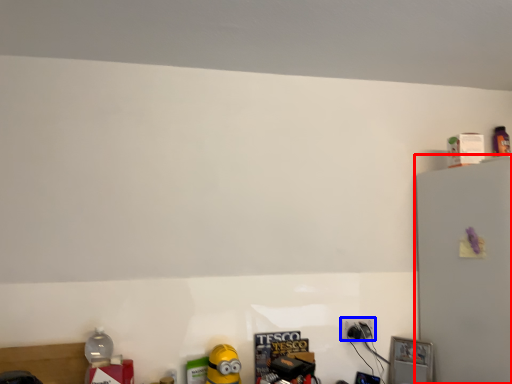
Question: Which point is closer to the camera, fridge (highlighted by a red box) or power plugs and sockets (highlighted by a blue box)?

Choices:
 (A) fridge
 (B) power plugs and sockets

Answer: (A)